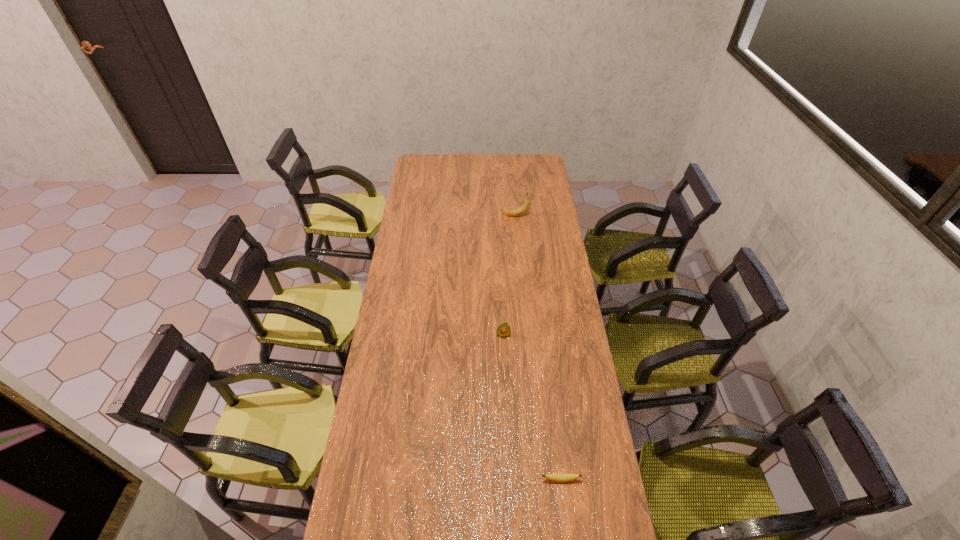
You are a GUI agent. You are given a task and a screenshot of the screen. Output one action in this format:
    pyautogui.click(x=<x>, y=<y>)
    Task: Click on the vacant space positioned on the right of the nearer banana
    This screenshot has width=960, height=540.
    Given the screenshot: What is the action you would take?
    pyautogui.click(x=607, y=479)

The image size is (960, 540). In order to click on free region at the far edge of the desktop in this screenshot , I will do `click(462, 170)`.

Identify the location of free space at the left edge of the desktop. The width and height of the screenshot is (960, 540). (404, 306).

Image resolution: width=960 pixels, height=540 pixels. In order to click on blank space at the right edge of the desktop in this screenshot , I will do `click(564, 469)`.

Identify the location of free space between the shortest object and the second nearest object. The image size is (960, 540). (532, 407).

This screenshot has height=540, width=960. Find the location of `vacant region between the avocado and the tallest object`. vacant region between the avocado and the tallest object is located at coordinates (509, 275).

This screenshot has height=540, width=960. What are the coordinates of `vacant space that is in between the farther banana and the nearest object` in the screenshot? It's located at (539, 347).

Identify which object is the closest to the avocado. Please provide its 2D coordinates. Your answer should be formatted as a tuple, i.e. [(x, y)], where the tuple contains the x and y coordinates of a point satisfying the conditions above.

[(557, 477)]

At what (x,y) coordinates should I click in order to perform the action: click on the second closest object to the taller banana. Please return your answer as a coordinate pair (x, y). The image size is (960, 540). Looking at the image, I should click on (557, 477).

Identify the location of vacant space that satisfies the following two spatial constraints: 1. on the back side of the nearer banana; 2. at the start of the peel on the farther banana. The width and height of the screenshot is (960, 540). (529, 216).